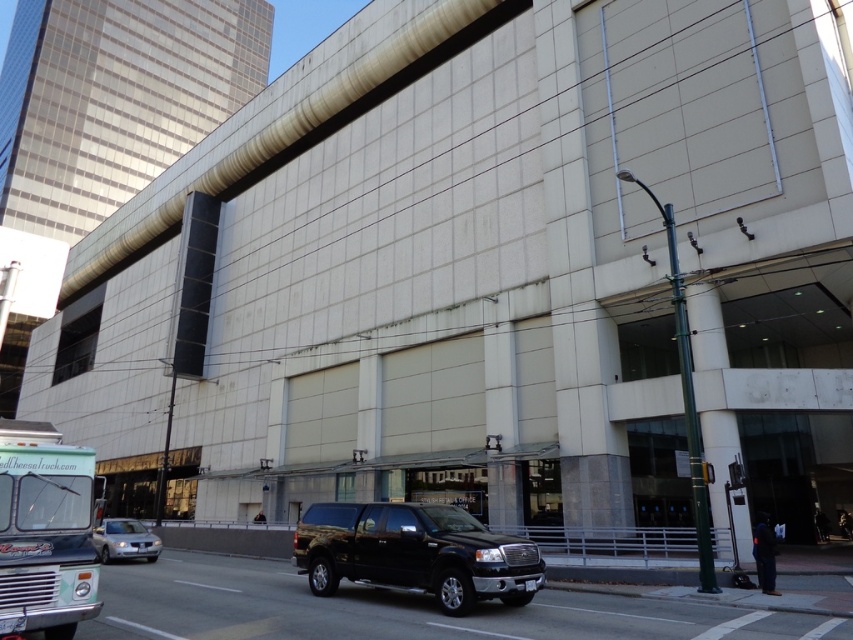
Can you confirm if teal matte bus at lower left is positioned above silver metallic sedan at lower left?

Yes.

Between teal matte bus at lower left and silver metallic sedan at lower left, which one appears on the right side from the viewer's perspective?

From the viewer's perspective, silver metallic sedan at lower left appears more on the right side.

Does point (36, 621) lie in front of point (158, 538)?

That is True.

Where is `teal matte bus at lower left`? teal matte bus at lower left is located at coordinates tap(45, 531).

Does black metallic suv at center appear on the right side of silver metallic sedan at lower left?

Indeed, black metallic suv at center is positioned on the right side of silver metallic sedan at lower left.

Is point (351, 548) farther from viewer compared to point (148, 556)?

That is False.

Is point (312, 573) in front of point (129, 532)?

Yes, point (312, 573) is in front of point (129, 532).

This screenshot has width=853, height=640. In order to click on black metallic suv at center in this screenshot , I will do `click(415, 552)`.

Who is taller, black metallic suv at center or teal matte bus at lower left?

Standing taller between the two is teal matte bus at lower left.

Between point (386, 504) and point (9, 621), which one is positioned behind?

Point (386, 504)

The image size is (853, 640). What do you see at coordinates (415, 552) in the screenshot?
I see `black metallic suv at center` at bounding box center [415, 552].

I want to click on black metallic suv at center, so click(415, 552).